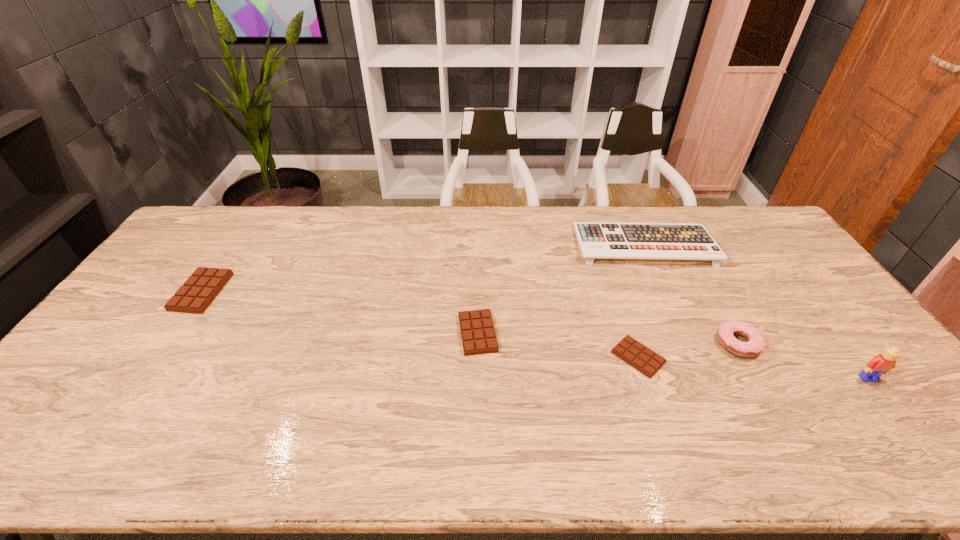
Please mark a free spot for a new candy_bar to balance the arrangement. Please provide its 2D coordinates. Your answer should be formatted as a tuple, i.e. [(x, y)], where the tuple contains the x and y coordinates of a point satisfying the conditions above.

[(333, 312)]